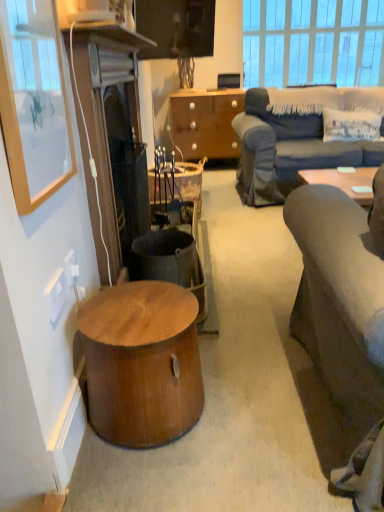
Identify the location of free space that is to the left of matte black speaker at upper center. This screenshot has height=512, width=384. (212, 90).